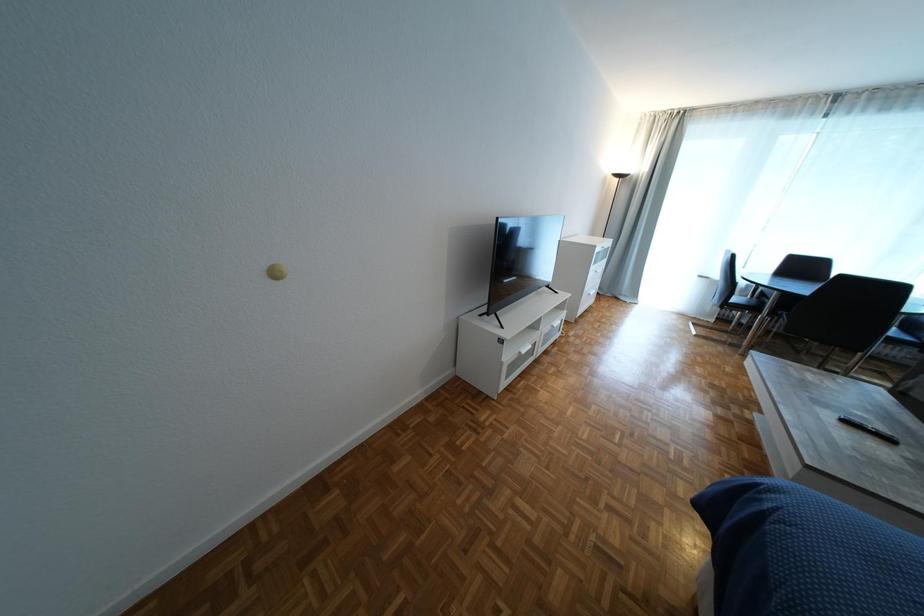
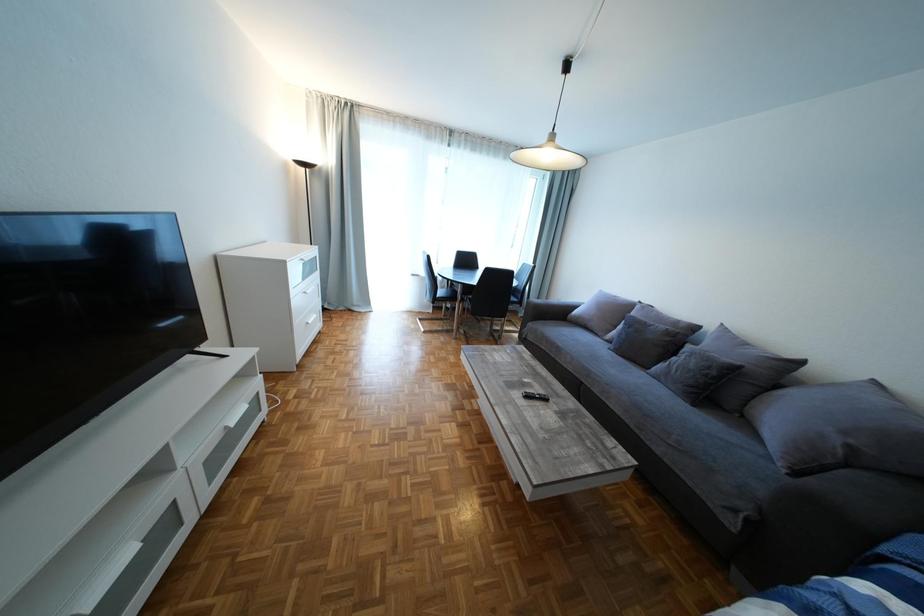
Question: The camera is either moving clockwise (left) or counter-clockwise (right) around the object. The first image is from the beginning of the video and the second image is from the end. Is the camera moving left or right when shooting the video?

Choices:
 (A) Left
 (B) Right

Answer: (A)